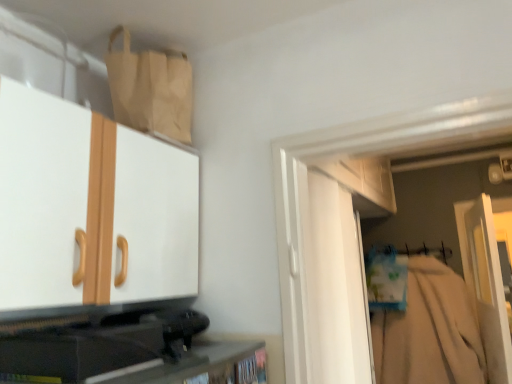
Question: From the image's perspective, is beige cotton robe at right beneath white matte door at center?

Choices:
 (A) yes
 (B) no

Answer: (A)

Question: Does beige cotton robe at right lie in front of white matte door at center?

Choices:
 (A) no
 (B) yes

Answer: (A)

Question: Is beige cotton robe at right thinner than white matte door at center?

Choices:
 (A) no
 (B) yes

Answer: (A)

Question: Is beige cotton robe at right positioned beyond the bounds of white matte door at center?

Choices:
 (A) yes
 (B) no

Answer: (A)

Question: From a real-world perspective, is beige cotton robe at right positioned over white matte door at center based on gravity?

Choices:
 (A) no
 (B) yes

Answer: (A)

Question: Is matte white cabinet at upper left, which ranks as the 2th cabinetry in bottom-to-top order, inside or outside of black plastic speaker at lower left, acting as the first cabinetry starting from the bottom?

Choices:
 (A) inside
 (B) outside

Answer: (B)

Question: From their relative heights in the image, would you say matte white cabinet at upper left, which ranks as the 2th cabinetry in bottom-to-top order, is taller or shorter than black plastic speaker at lower left, the 2th cabinetry from the top?

Choices:
 (A) short
 (B) tall

Answer: (B)

Question: In the image, is matte white cabinet at upper left, which ranks as the 2th cabinetry in bottom-to-top order, positioned in front of or behind black plastic speaker at lower left, acting as the first cabinetry starting from the bottom?

Choices:
 (A) front
 (B) behind

Answer: (A)

Question: Does point (95, 291) appear closer or farther from the camera than point (253, 367)?

Choices:
 (A) farther
 (B) closer

Answer: (B)

Question: From the image's perspective, is beige cotton robe at right positioned above or below matte white cabinet at upper left, which ranks as the 2th cabinetry in bottom-to-top order?

Choices:
 (A) above
 (B) below

Answer: (B)

Question: Considering the positions of beige cotton robe at right and matte white cabinet at upper left, which ranks as the 2th cabinetry in bottom-to-top order, in the image, is beige cotton robe at right wider or thinner than matte white cabinet at upper left, which ranks as the 2th cabinetry in bottom-to-top order,?

Choices:
 (A) thin
 (B) wide

Answer: (A)

Question: Based on their positions, is beige cotton robe at right located to the left or right of matte white cabinet at upper left, which ranks as the 2th cabinetry in bottom-to-top order?

Choices:
 (A) left
 (B) right

Answer: (B)

Question: Relative to matte white cabinet at upper left, the 1th cabinetry in the top-to-bottom sequence, is beige cotton robe at right in front or behind?

Choices:
 (A) behind
 (B) front

Answer: (A)

Question: Looking at their shapes, would you say black plastic speaker at lower left, the 2th cabinetry from the top, is wider or thinner than white fabric hanger at right?

Choices:
 (A) thin
 (B) wide

Answer: (B)

Question: From the image's perspective, is black plastic speaker at lower left, the 2th cabinetry from the top, positioned above or below white fabric hanger at right?

Choices:
 (A) above
 (B) below

Answer: (A)